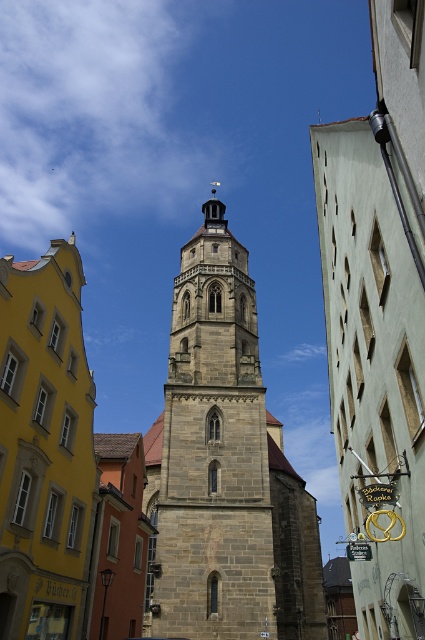
Question: Which of the following is the farthest from the observer?

Choices:
 (A) stone church at left
 (B) gray stone tower at center

Answer: (B)

Question: Can you confirm if gray stone tower at center is positioned to the right of stone church at left?

Choices:
 (A) no
 (B) yes

Answer: (B)

Question: Does gray stone tower at center appear over stone church at left?

Choices:
 (A) yes
 (B) no

Answer: (A)

Question: Can you confirm if gray stone tower at center is positioned to the left of stone church at left?

Choices:
 (A) no
 (B) yes

Answer: (A)

Question: Which object appears farthest from the camera in this image?

Choices:
 (A) gray stone tower at center
 (B) stone church at left

Answer: (A)